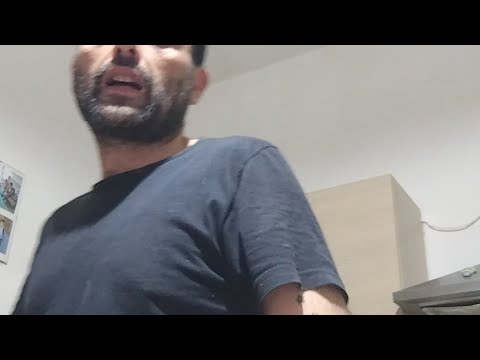
This screenshot has width=480, height=360. What are the coordinates of `cable` in the screenshot? It's located at (434, 231).